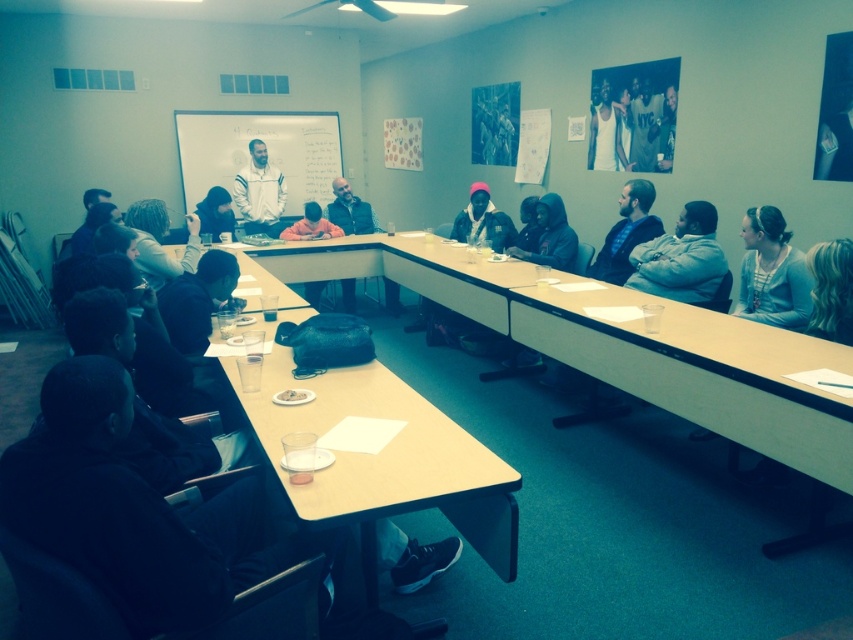
Question: Does blue sweater at right lie behind matte black jacket at upper center?

Choices:
 (A) yes
 (B) no

Answer: (B)

Question: Estimate the real-world distances between objects in this image. Which object is closer to the matte black jacket at upper center?

Choices:
 (A) white matte jacket at center
 (B) orange fleece jacket at center

Answer: (B)

Question: Does blonde hair at upper right appear on the left side of white matte jacket at center?

Choices:
 (A) yes
 (B) no

Answer: (B)

Question: Which point is closer to the camera?

Choices:
 (A) blue sweater at right
 (B) matte black jacket at upper center
 (C) white matte jacket at center
 (D) blonde hair at upper right

Answer: (D)

Question: Considering the real-world distances, which object is farthest from the white matte jacket at center?

Choices:
 (A) light brown wood table at center
 (B) matte black jacket at upper center

Answer: (A)

Question: Is white matte jacket at center closer to the viewer compared to orange fleece jacket at center?

Choices:
 (A) no
 (B) yes

Answer: (A)